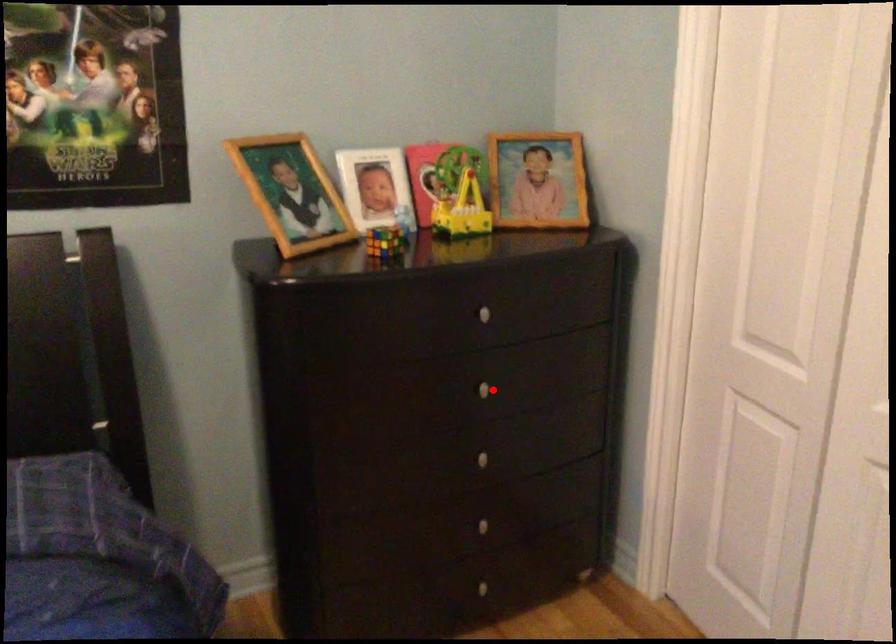
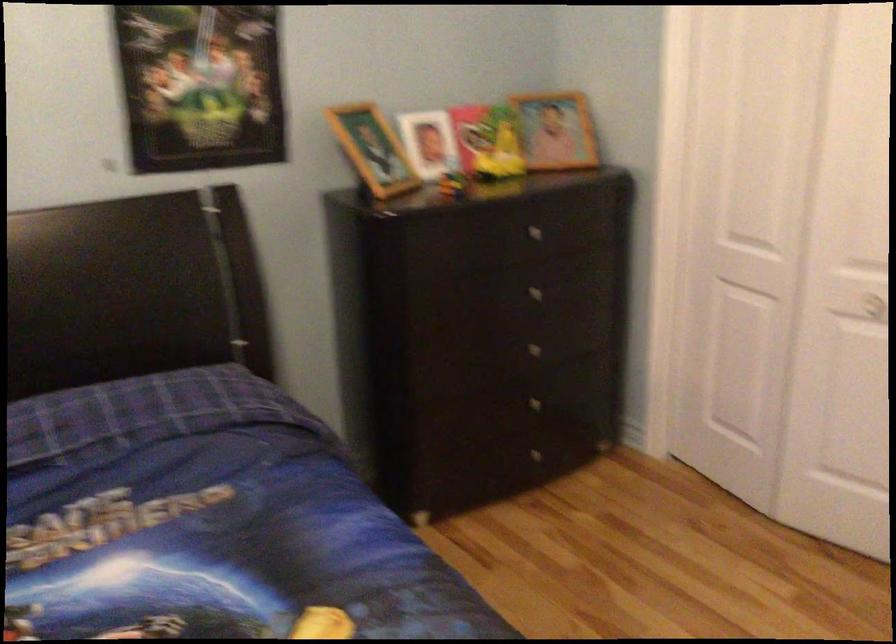
Question: I am providing you with two images of the same scene from different viewpoints. Given a red point in image1, look at the same physical point in image2. Is it:

Choices:
 (A) Closer to the viewpoint
 (B) Farther from the viewpoint

Answer: (B)